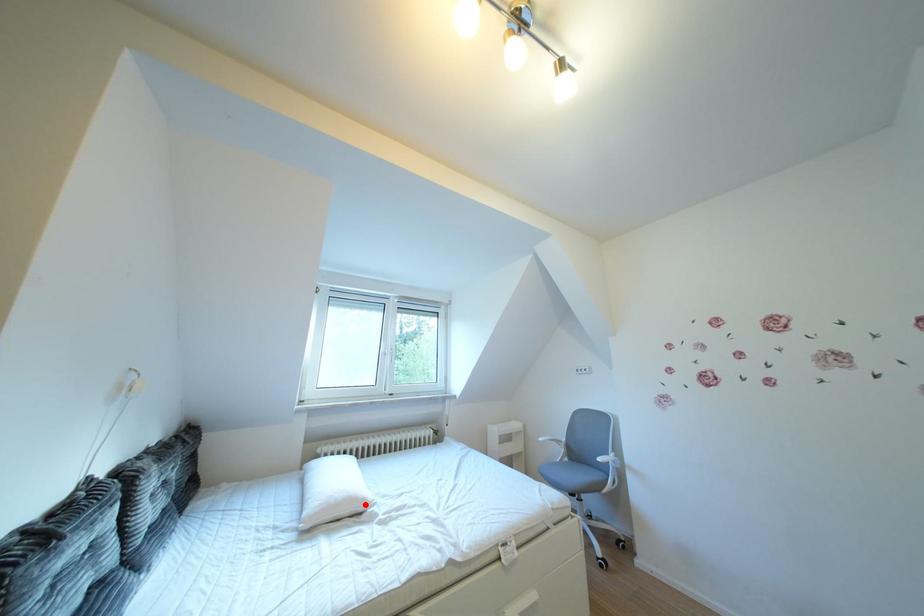
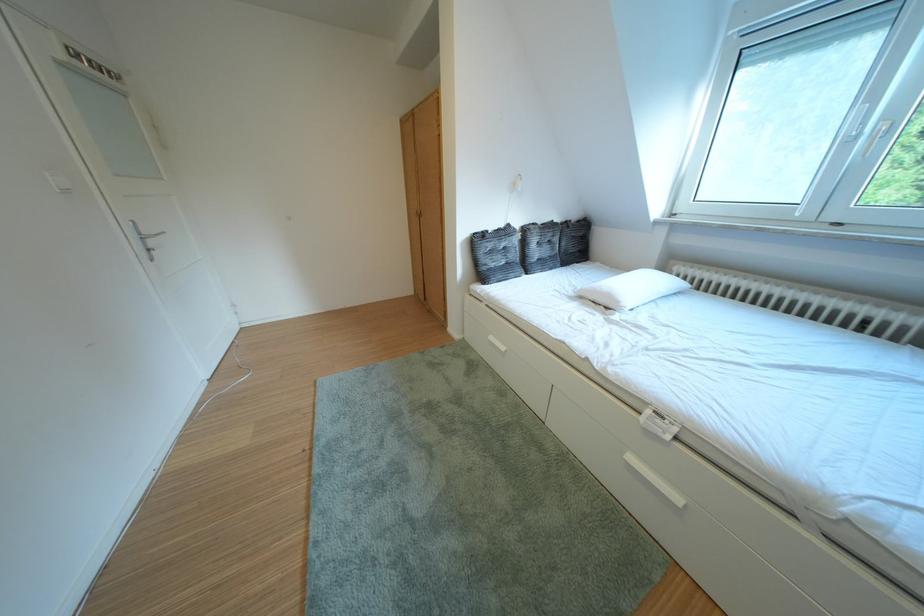
Question: A red point is marked in image1. In image2, is the corresponding 3D point closer to the camera or farther? Reply with the corresponding letter.

Choices:
 (A) The corresponding 3D point is closer.
 (B) The corresponding 3D point is farther.

Answer: (A)